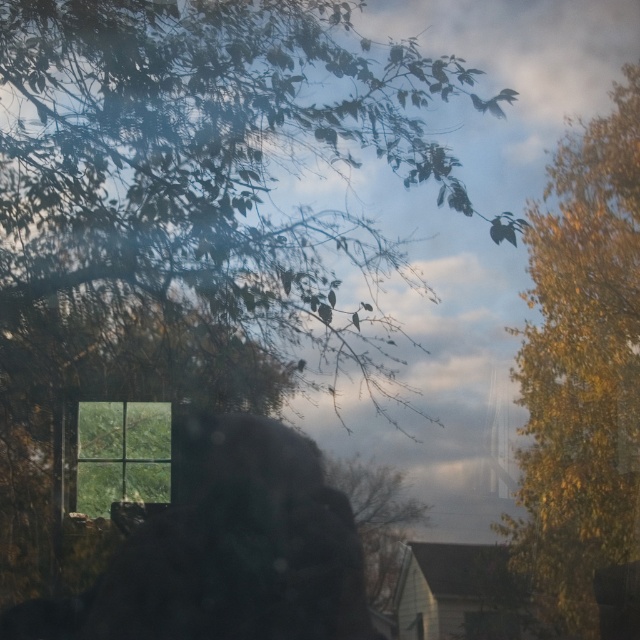
Question: Considering the real-world distances, which object is closest to the silky black hair at center?

Choices:
 (A) green leafy tree at upper left
 (B) green leafy tree at center

Answer: (B)

Question: Does green leafy tree at upper left come in front of golden yellow leaves at right?

Choices:
 (A) no
 (B) yes

Answer: (A)

Question: Is green leafy tree at upper left below clear glass window at center?

Choices:
 (A) yes
 (B) no

Answer: (B)

Question: Considering the real-world distances, which object is closest to the silky black hair at center?

Choices:
 (A) clear glass window at center
 (B) green leafy tree at center
 (C) green leafy tree at upper left
 (D) golden yellow leaves at right

Answer: (A)

Question: Does green leafy tree at upper left appear on the right side of golden yellow leaves at right?

Choices:
 (A) yes
 (B) no

Answer: (B)

Question: Among these objects, which one is nearest to the camera?

Choices:
 (A) green leafy tree at center
 (B) green leafy tree at upper left
 (C) clear glass window at center
 (D) golden yellow leaves at right

Answer: (D)